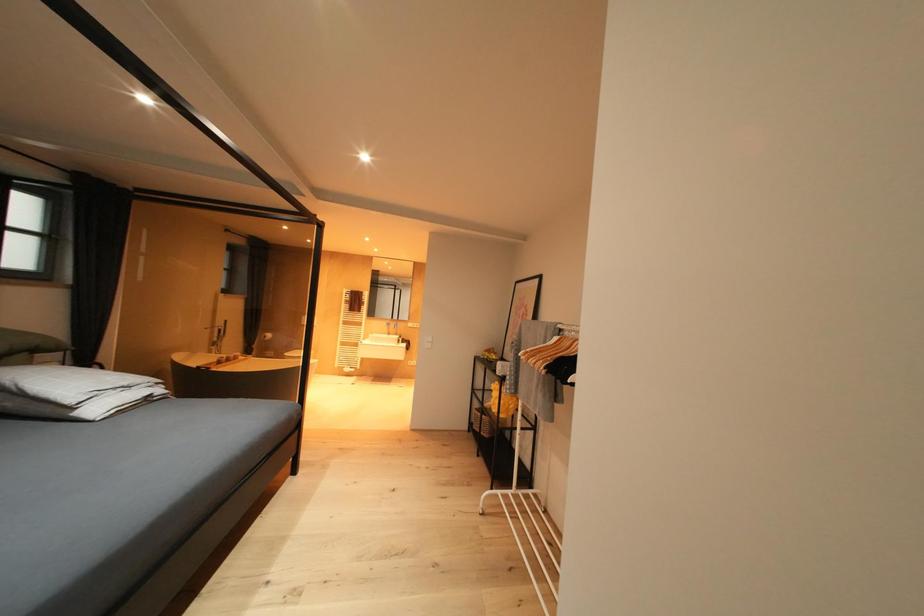
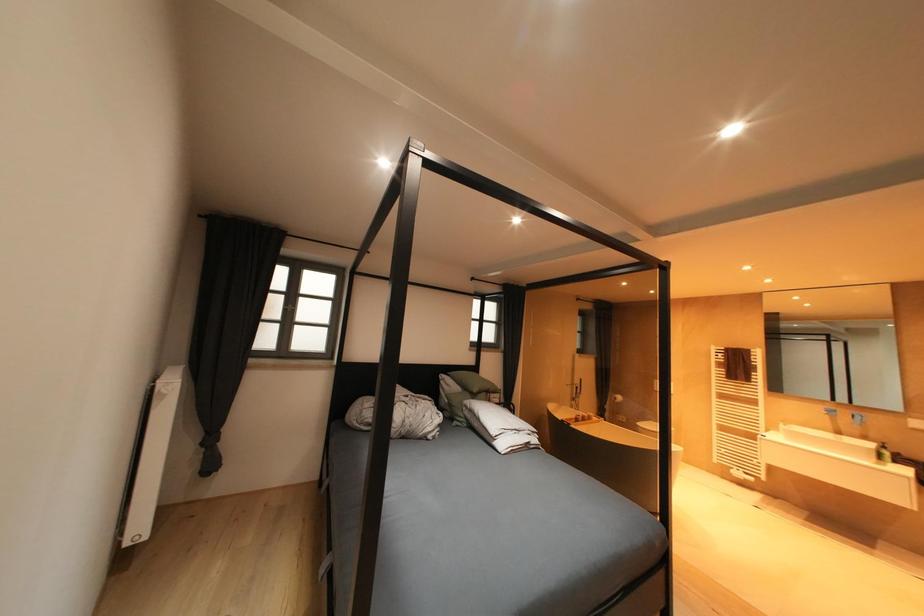
Question: The camera is either moving clockwise (left) or counter-clockwise (right) around the object. The first image is from the beginning of the video and the second image is from the end. Is the camera moving left or right when shooting the video?

Choices:
 (A) Left
 (B) Right

Answer: (B)